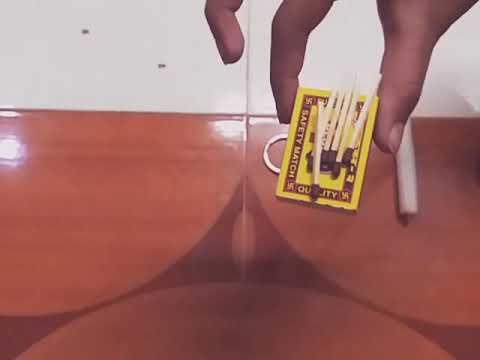
Where is `reflection from lights`? Image resolution: width=480 pixels, height=360 pixels. reflection from lights is located at coordinates (232, 126), (11, 149).